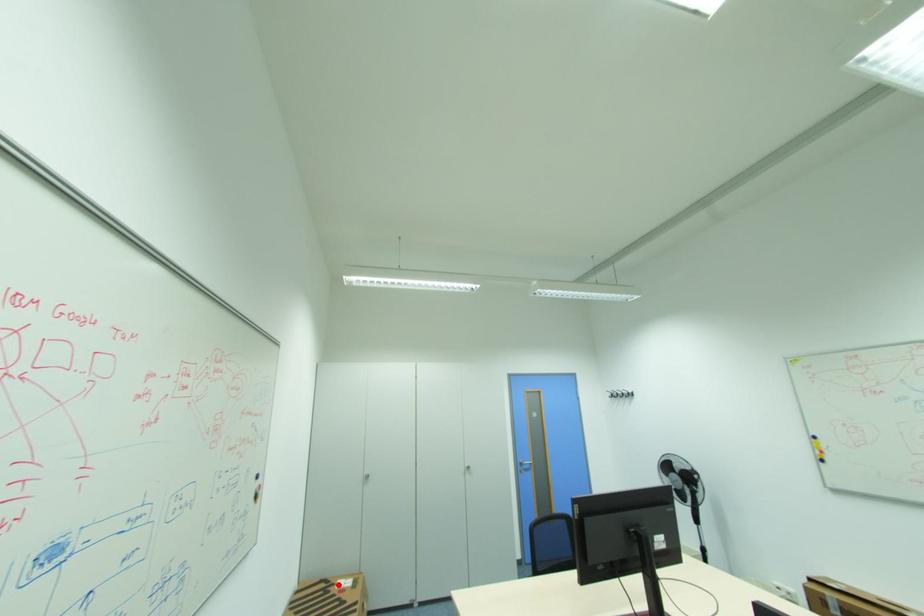
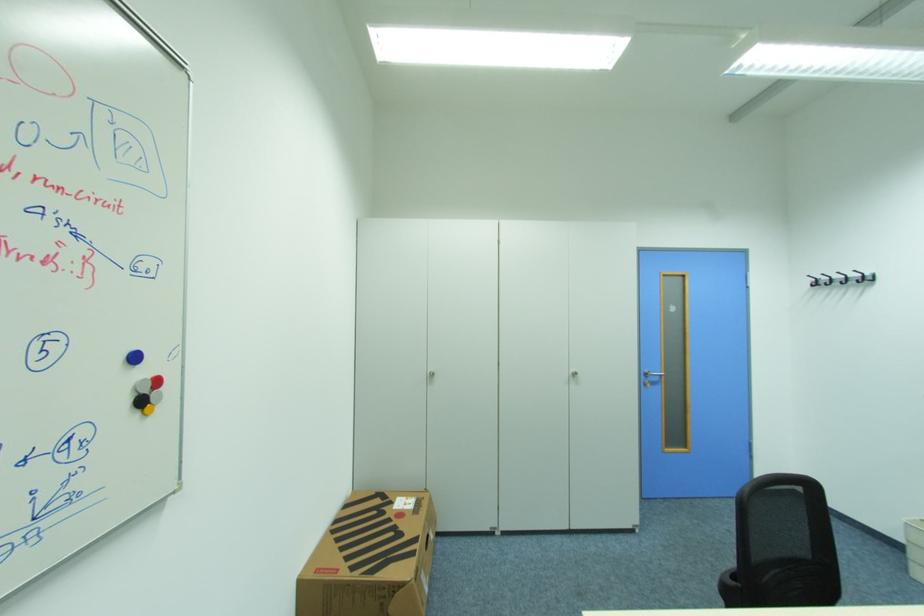
Question: I am providing you with two images of the same scene from different viewpoints. A red point is marked on the first image. At the location where the point appears in image 1, is it still visible in image 2?

Choices:
 (A) Yes
 (B) No

Answer: (A)